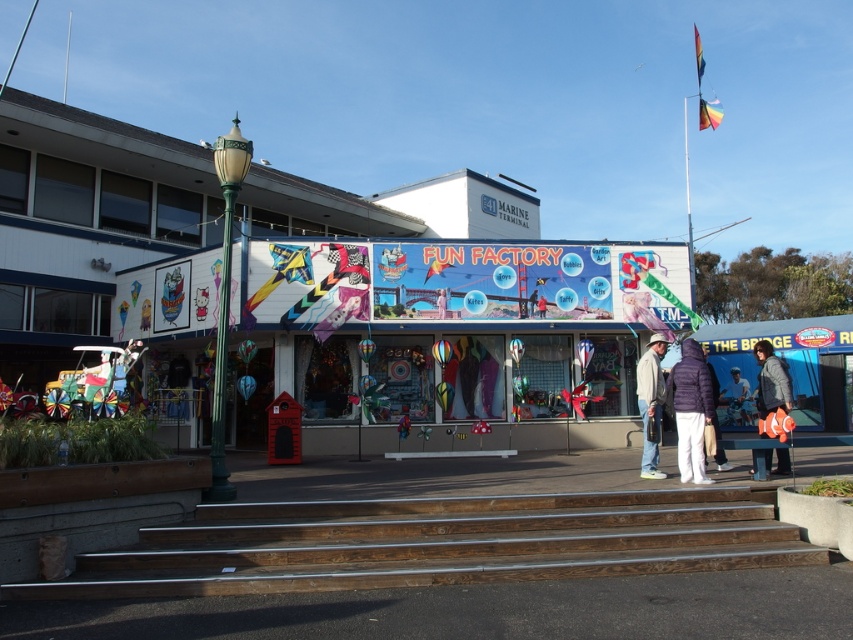
Question: Is purple down jacket at lower center above white fabric person at center?

Choices:
 (A) yes
 (B) no

Answer: (A)

Question: Which point is closer to the camera?

Choices:
 (A) purple fuzzy jacket at lower right
 (B) light brown leather jacket at center
 (C) white fabric person at center
 (D) gray fuzzy jacket at lower right

Answer: (A)

Question: Which object is the closest to the purple down jacket at lower center?

Choices:
 (A) light brown leather jacket at center
 (B) gray fuzzy jacket at lower right

Answer: (A)

Question: Is gray fuzzy jacket at lower right closer to the viewer compared to white fabric person at center?

Choices:
 (A) yes
 (B) no

Answer: (A)

Question: Estimate the real-world distances between objects in this image. Which object is closer to the gray fuzzy jacket at lower right?

Choices:
 (A) purple down jacket at lower center
 (B) purple fuzzy jacket at lower right

Answer: (A)

Question: Is light brown leather jacket at center further to camera compared to gray fuzzy jacket at lower right?

Choices:
 (A) no
 (B) yes

Answer: (B)